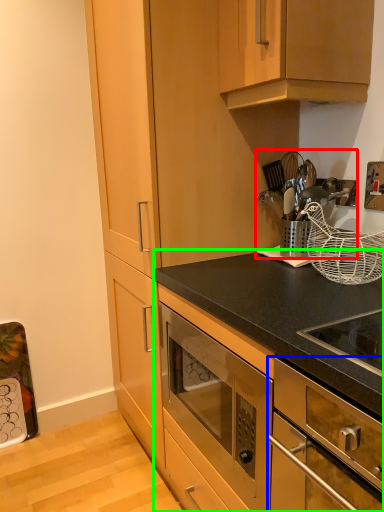
Question: Which object is positioned closest to appliance (highlighted by a red box)? Select from oven (highlighted by a blue box) and cabinetry (highlighted by a green box).

Choices:
 (A) oven
 (B) cabinetry

Answer: (B)